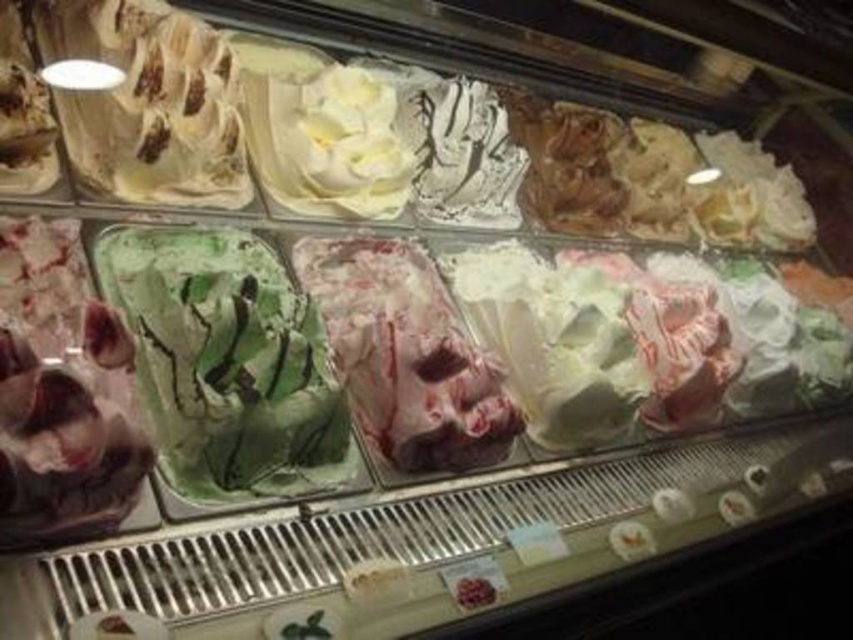
From the picture: You are at an ice cream shop and want to choose between the green swirled ice cream at center and the swirled pink ice cream at center. Which one has a smaller width?

The green swirled ice cream at center is thinner than the swirled pink ice cream at center, so the green swirled ice cream at center has a smaller width.